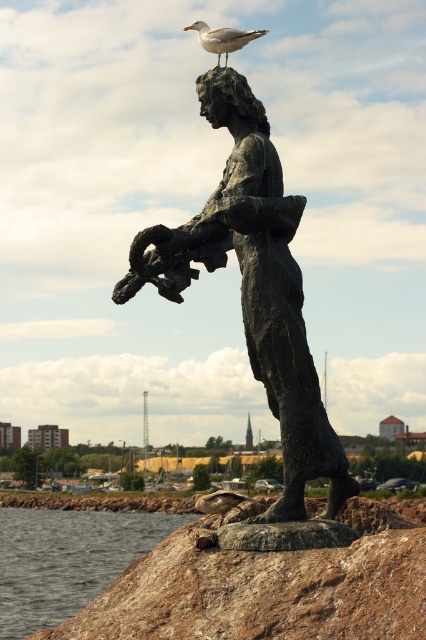
Between bronze statue at center and white feathered seagull at upper center, which one is positioned lower?

Positioned lower is bronze statue at center.

The width and height of the screenshot is (426, 640). Describe the element at coordinates (255, 292) in the screenshot. I see `bronze statue at center` at that location.

Does point (334, 468) come farther from viewer compared to point (207, 33)?

No, (334, 468) is in front of (207, 33).

Find the location of a particular element. bronze statue at center is located at coordinates (255, 292).

Which is in front, point (123, 566) or point (203, 33)?

Point (203, 33) is more forward.

Who is lower down, smooth gray water at lower left or white feathered seagull at upper center?

Positioned lower is smooth gray water at lower left.

Identify the location of smooth gray water at lower left. Image resolution: width=426 pixels, height=640 pixels. (66, 560).

Measure the distance between bronze statue at center and smooth gray water at lower left.

bronze statue at center is 285.04 feet away from smooth gray water at lower left.

In the scene shown: Does bronze statue at center have a smaller size compared to smooth gray water at lower left?

Indeed, bronze statue at center has a smaller size compared to smooth gray water at lower left.

The width and height of the screenshot is (426, 640). Find the location of `bronze statue at center`. bronze statue at center is located at coordinates (255, 292).

Identify the location of bronze statue at center. The height and width of the screenshot is (640, 426). (255, 292).